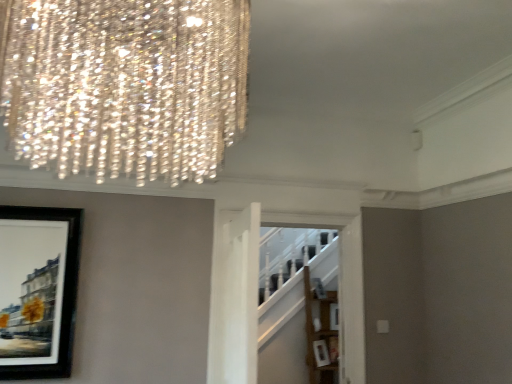
Question: In terms of width, does wooden shelf at center look wider or thinner when compared to black matte picture frame at left?

Choices:
 (A) wide
 (B) thin

Answer: (A)

Question: Does point (307, 357) appear closer or farther from the camera than point (62, 375)?

Choices:
 (A) farther
 (B) closer

Answer: (A)

Question: From a real-world perspective, relative to black matte picture frame at left, is wooden shelf at center vertically above or below?

Choices:
 (A) below
 (B) above

Answer: (A)

Question: Is black matte picture frame at left taller or shorter than wooden shelf at center?

Choices:
 (A) tall
 (B) short

Answer: (B)

Question: From a real-world perspective, relative to wooden shelf at center, is black matte picture frame at left vertically above or below?

Choices:
 (A) below
 (B) above

Answer: (B)

Question: Is black matte picture frame at left in front of or behind wooden shelf at center in the image?

Choices:
 (A) behind
 (B) front

Answer: (B)

Question: Would you say black matte picture frame at left is to the left or to the right of wooden shelf at center in the picture?

Choices:
 (A) right
 (B) left

Answer: (B)